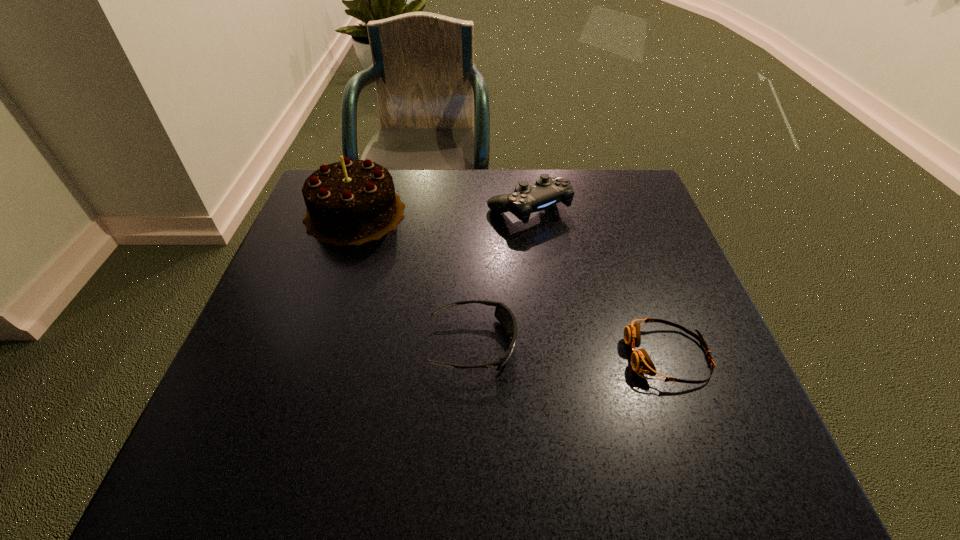
Locate an element on the screen. birthday cake is located at coordinates (351, 202).

The height and width of the screenshot is (540, 960). Identify the location of the tallest object. (351, 202).

I want to click on control, so click(x=547, y=191).

You are a GUI agent. You are given a task and a screenshot of the screen. Output one action in this format:
    pyautogui.click(x=<x>, y=<y>)
    Task: Click on the left goggles
    This screenshot has height=540, width=960.
    Given the screenshot: What is the action you would take?
    pyautogui.click(x=503, y=314)

The width and height of the screenshot is (960, 540). I want to click on the shorter goggles, so click(x=641, y=362).

The width and height of the screenshot is (960, 540). Find the location of `the right goggles`. the right goggles is located at coordinates (641, 362).

In order to click on blank area located on the right of the birthday cake in this screenshot , I will do `click(432, 213)`.

Locate an element on the screen. The height and width of the screenshot is (540, 960). vacant space located 0.130m on the left of the control is located at coordinates (438, 208).

Where is `blank space located on the lenses of the left goggles`? The image size is (960, 540). blank space located on the lenses of the left goggles is located at coordinates (672, 345).

At what (x,y) coordinates should I click in order to perform the action: click on free space located 0.060m with the lenses facing forward on the shortest object. Please return your answer as a coordinate pair (x, y). This screenshot has width=960, height=540. Looking at the image, I should click on (595, 356).